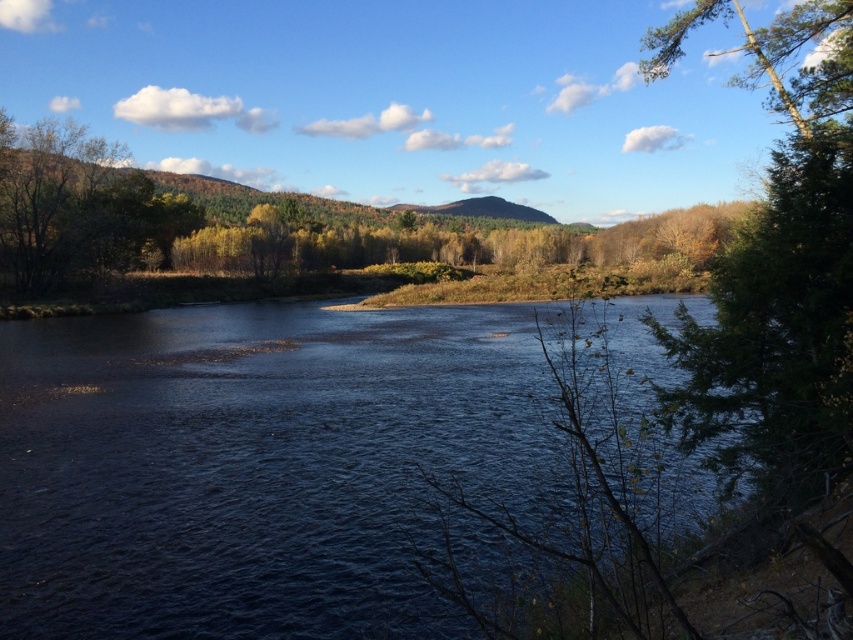
You are standing on the riverbank and want to cross the river to reach the green textured tree at right. Based on the scene, can you determine if the dark blue water at center is between you and the tree?

Yes, the dark blue water at center is located below the green textured tree at right, which means it is between you and the tree. To reach the tree, you would need to cross the water.

You are planning to cross the river using a small boat. The boat can only carry items that are narrower than the river. Based on the scene, can you determine if the boat can safely carry the green textured tree at right across the dark blue water at center?

The dark blue water at center is wider than the green textured tree at right, so the boat can safely carry the green textured tree at right across the dark blue water at center since the tree is narrower than the river.